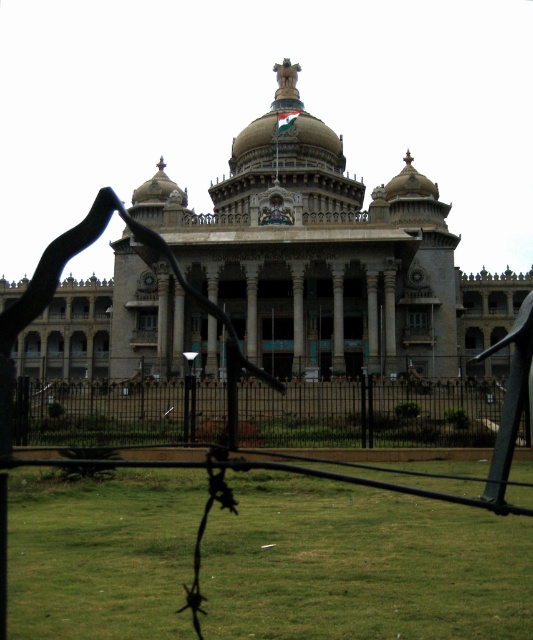
You are standing in front of the historical building and want to take a photo of the statue on the central dome. There is a restricted area marked by the black metal fence with barbed wire. Can you estimate how far you need to walk from your current position to reach the point where the statue is closest to the camera? The point is labeled as point (366, 513) in the image.

The distance of point (366, 513) from camera is 80.13 meters, so you need to walk approximately 80.13 meters to reach the point where the statue is closest to the camera.

You are a landscape architect planning to install a new pathway. You see the green grass at lower center and the black metal fence at center. Which area has more space available for the pathway?

The green grass at lower center has more space available for the pathway because it is bigger than the black metal fence at center.

You are standing in front of the grand historical building and want to walk towards the green grass at lower center. Based on the coordinates provided, in which direction should you move relative to your current position?

The green grass at lower center is located at coordinates point (360, 564). Since the coordinate system typically places the origin at the bottom left corner, moving towards the lower center would mean heading slightly to the right and forward from your current position.